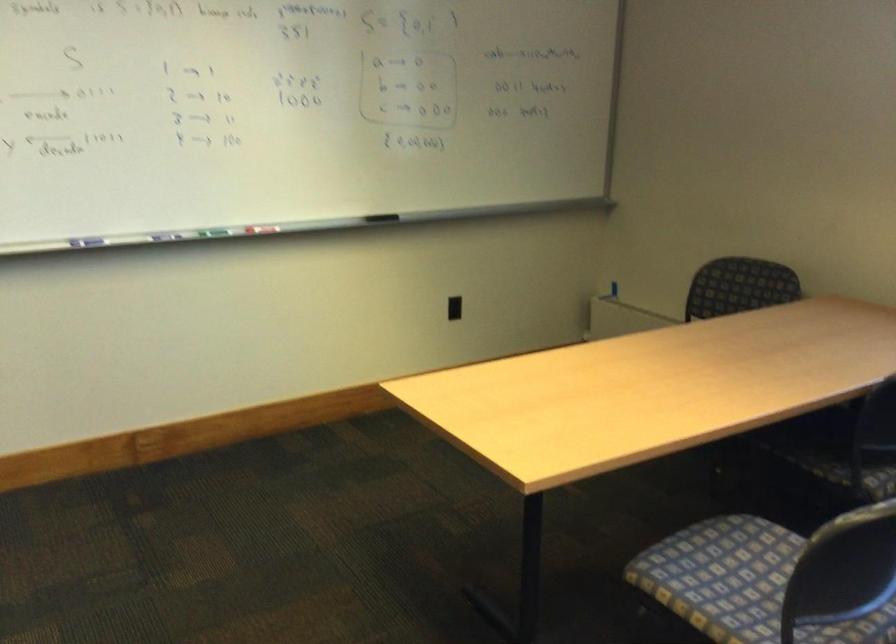
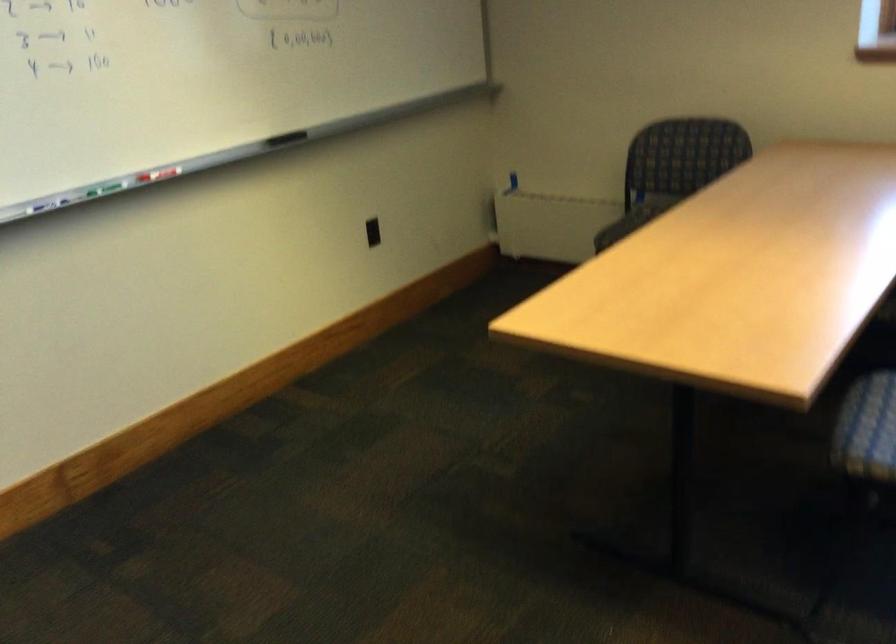
Where in the second image is the point corresponding to point 377,214 from the first image?

(286, 138)